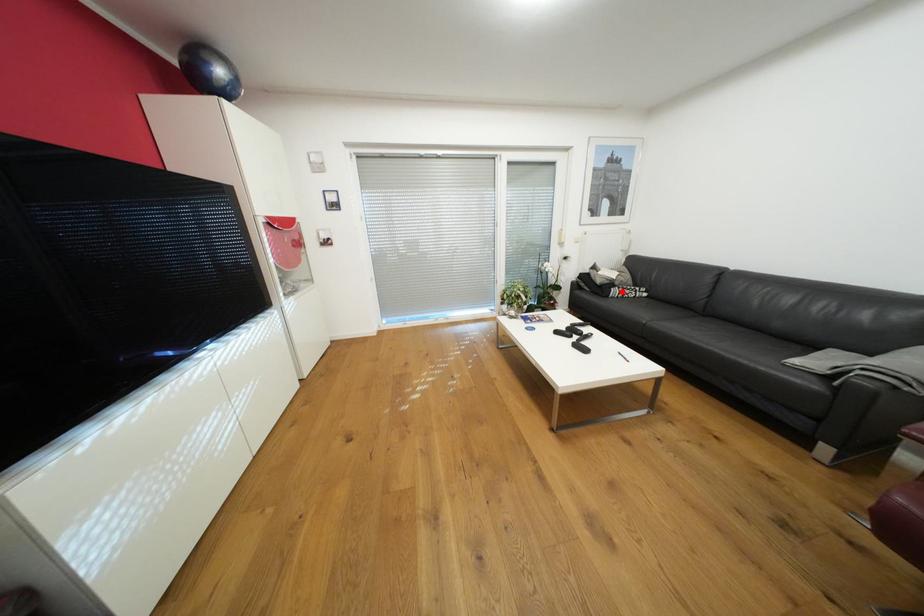
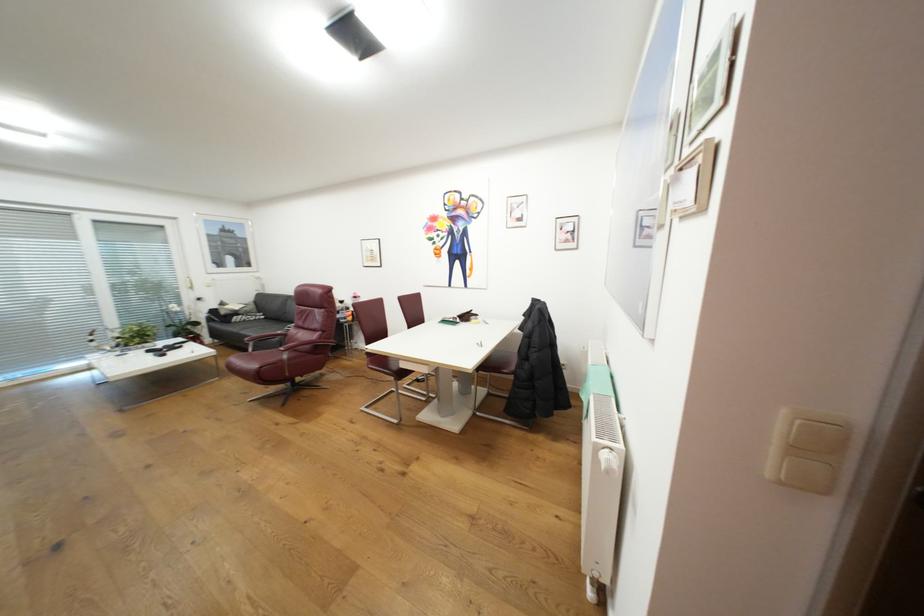
Question: I am providing you with two images of the same scene from different viewpoints. Given a red point in image1, look at the same physical point in image2. Is it:

Choices:
 (A) Closer to the viewpoint
 (B) Farther from the viewpoint

Answer: (B)